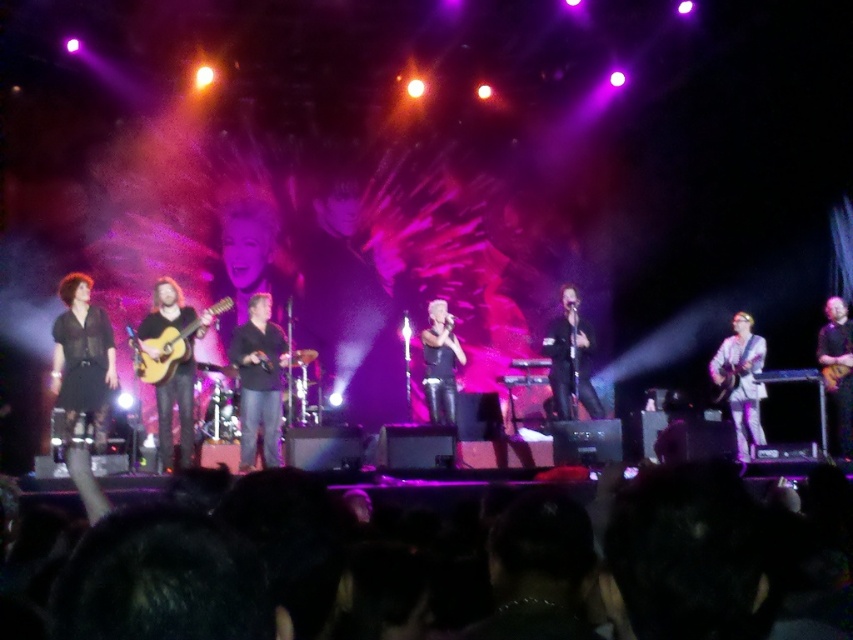
You are a stagehand holding a 1.5 meter long ladder. You need to place it between the black hair at lower center and the camera. Is there enough space for the ladder to fit without overlapping either?

The distance between the black hair at lower center and the camera is 1.41 meters. Since the ladder is 1.5 meters long, it is slightly longer than the available space. Therefore, the ladder cannot fit without overlapping either the black hair at lower center or the camera.